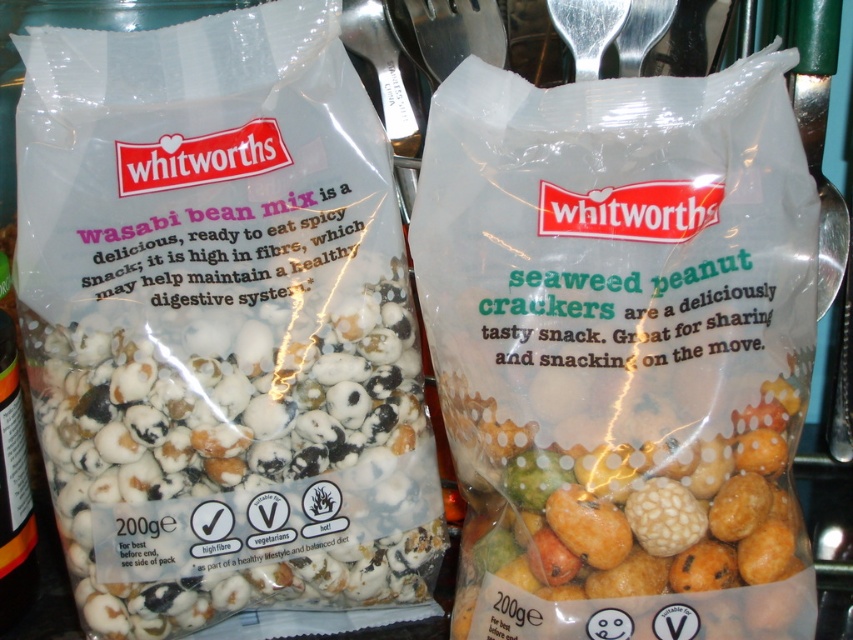
Question: Is white matte popcorn mix at left bigger than multicolored textured crackers at center?

Choices:
 (A) no
 (B) yes

Answer: (B)

Question: Which point is farther to the camera?

Choices:
 (A) (392, 298)
 (B) (668, 509)

Answer: (A)

Question: Which object appears closest to the camera in this image?

Choices:
 (A) multicolored textured crackers at center
 (B) white matte popcorn mix at left

Answer: (A)

Question: Is white matte popcorn mix at left thinner than multicolored textured crackers at center?

Choices:
 (A) yes
 (B) no

Answer: (B)

Question: Which object is closer to the camera taking this photo?

Choices:
 (A) white matte popcorn mix at left
 (B) multicolored textured crackers at center

Answer: (B)

Question: Can you confirm if white matte popcorn mix at left is bigger than multicolored textured crackers at center?

Choices:
 (A) yes
 (B) no

Answer: (A)